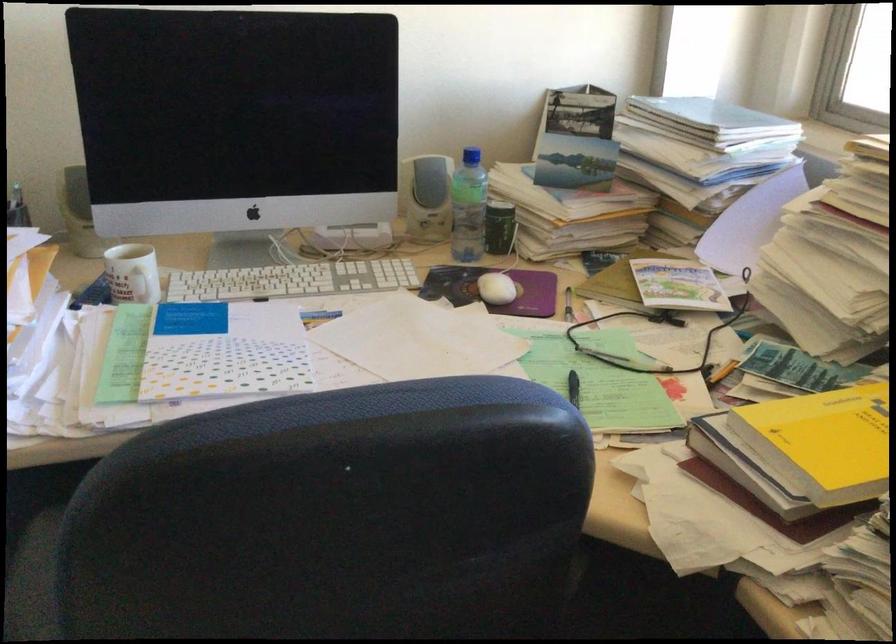
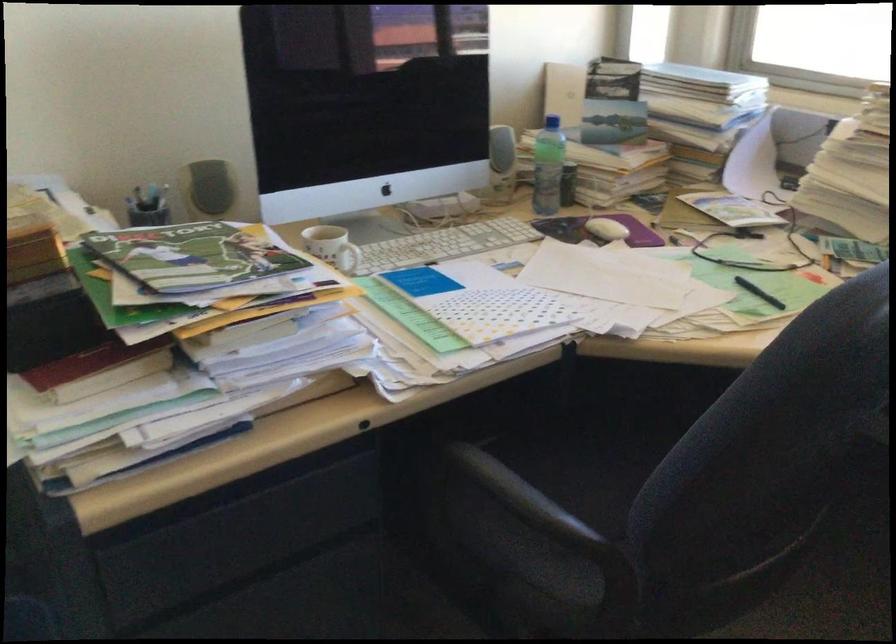
Find the pixel in the second image that matches (583,399) in the first image.

(759, 292)